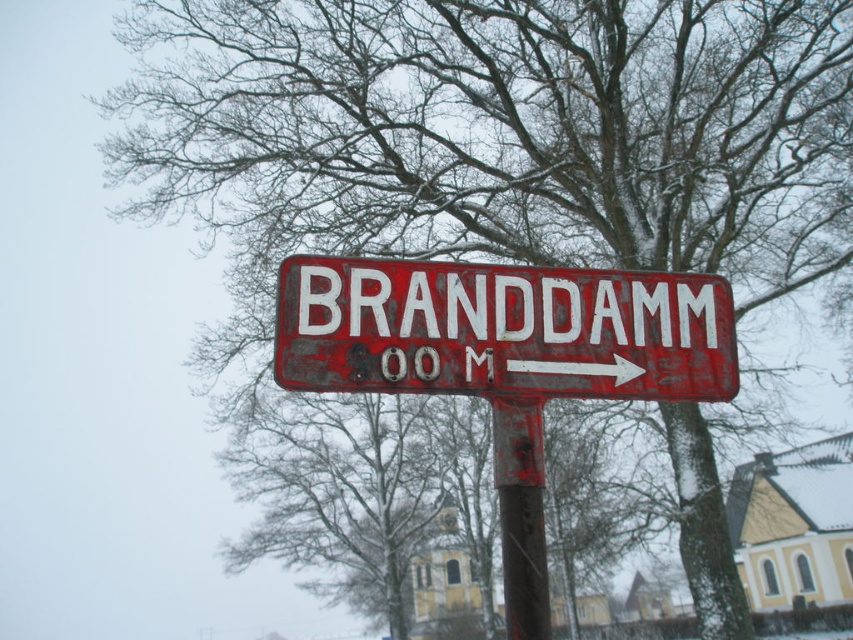
Question: Which point is farther from the camera taking this photo?

Choices:
 (A) (531, 413)
 (B) (645, 369)

Answer: (B)

Question: Is rusty metal sign at center closer to the viewer compared to rusty metal pole at center?

Choices:
 (A) yes
 (B) no

Answer: (A)

Question: Can you confirm if rusty metal sign at center is wider than rusty metal pole at center?

Choices:
 (A) yes
 (B) no

Answer: (A)

Question: Which point appears farthest from the camera in this image?

Choices:
 (A) (529, 547)
 (B) (283, 289)

Answer: (B)

Question: Can you confirm if rusty metal sign at center is wider than rusty metal pole at center?

Choices:
 (A) yes
 (B) no

Answer: (A)